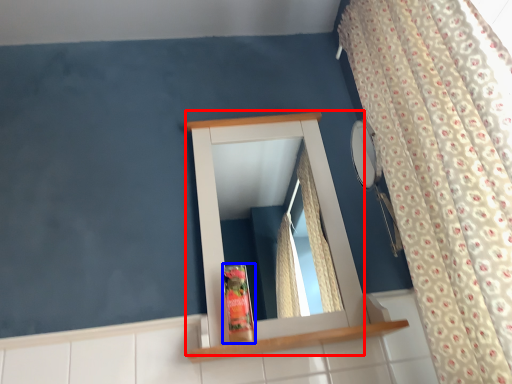
Question: Which point is closer to the camera, medicine cabinet (highlighted by a red box) or toiletry (highlighted by a blue box)?

Choices:
 (A) medicine cabinet
 (B) toiletry

Answer: (A)